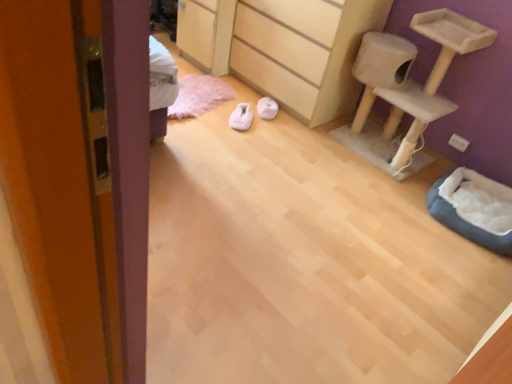
Question: Is white fabric slipper at center, which is the second footwear from left to right, bigger than dark gray plush cat bed at lower right?

Choices:
 (A) no
 (B) yes

Answer: (A)

Question: Is the position of white fabric slipper at center, which is the first footwear from right to left, more distant than that of dark gray plush cat bed at lower right?

Choices:
 (A) no
 (B) yes

Answer: (B)

Question: Can you confirm if white fabric slipper at center, which is the second footwear from left to right, is positioned to the left of dark gray plush cat bed at lower right?

Choices:
 (A) yes
 (B) no

Answer: (A)

Question: Is white fabric slipper at center, which is the first footwear from right to left, oriented towards dark gray plush cat bed at lower right?

Choices:
 (A) no
 (B) yes

Answer: (A)

Question: Is the depth of white fabric slipper at center, which is the second footwear from left to right, less than that of dark gray plush cat bed at lower right?

Choices:
 (A) yes
 (B) no

Answer: (B)

Question: From a real-world perspective, is dark gray plush cat bed at lower right on top of white fabric slipper at center, the second footwear positioned from the right?

Choices:
 (A) yes
 (B) no

Answer: (A)

Question: From a real-world perspective, is dark gray plush cat bed at lower right below white fabric slipper at center, arranged as the first footwear when viewed from the left?

Choices:
 (A) no
 (B) yes

Answer: (A)

Question: Is the position of dark gray plush cat bed at lower right less distant than that of white fabric slipper at center, arranged as the first footwear when viewed from the left?

Choices:
 (A) no
 (B) yes

Answer: (B)

Question: Considering the relative sizes of dark gray plush cat bed at lower right and white fabric slipper at center, the second footwear positioned from the right, in the image provided, is dark gray plush cat bed at lower right taller than white fabric slipper at center, the second footwear positioned from the right,?

Choices:
 (A) yes
 (B) no

Answer: (A)

Question: Is dark gray plush cat bed at lower right smaller than white fabric slipper at center, the second footwear positioned from the right?

Choices:
 (A) no
 (B) yes

Answer: (A)

Question: Is dark gray plush cat bed at lower right wider than white fabric slipper at center, the second footwear positioned from the right?

Choices:
 (A) yes
 (B) no

Answer: (A)

Question: Does white fabric slipper at center, which is the first footwear from right to left, turn towards white fabric slipper at center, the second footwear positioned from the right?

Choices:
 (A) yes
 (B) no

Answer: (B)